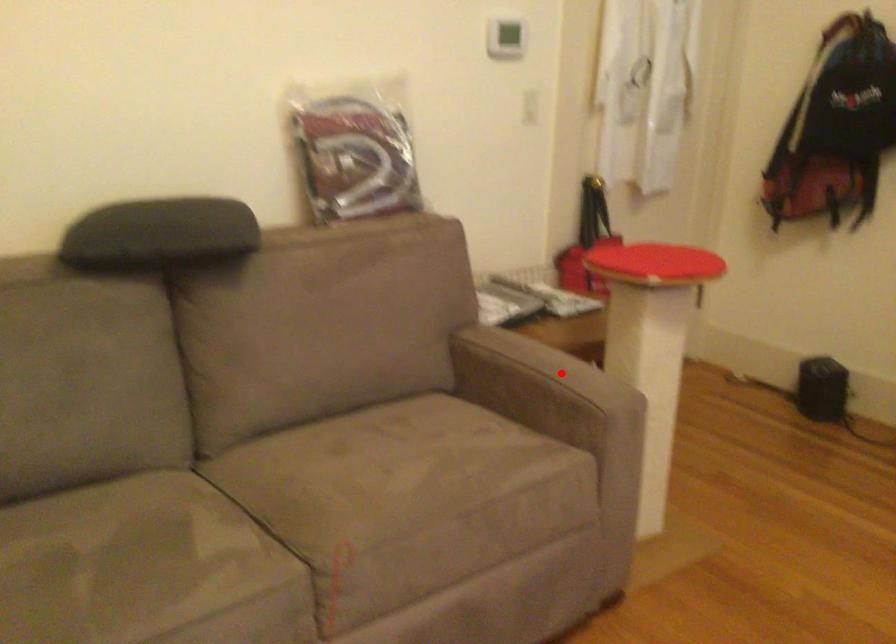
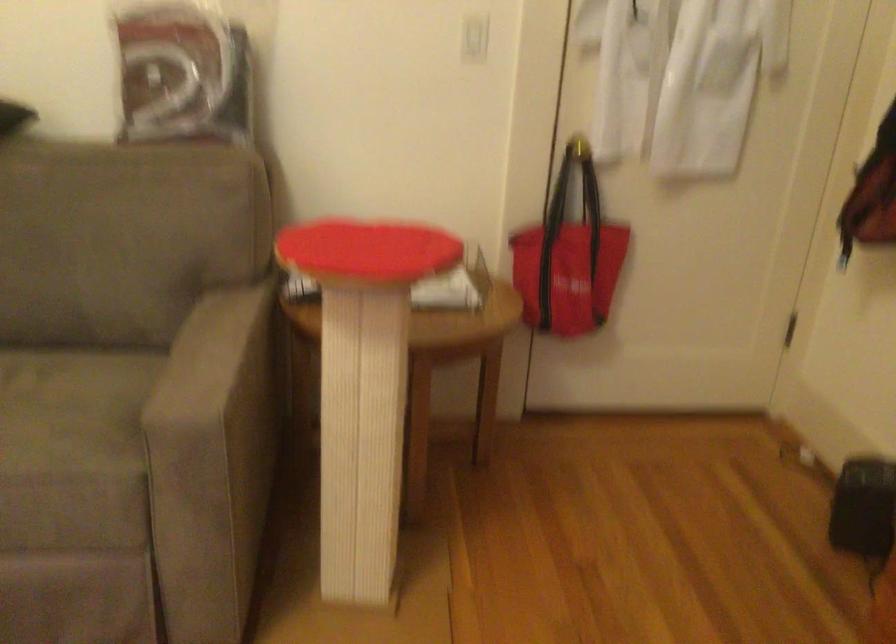
Question: I am providing you with two images of the same scene from different viewpoints. A red point is shown in image1. For the corresponding object point in image2, is it positioned nearer or farther from the camera?

Choices:
 (A) Nearer
 (B) Farther

Answer: (A)